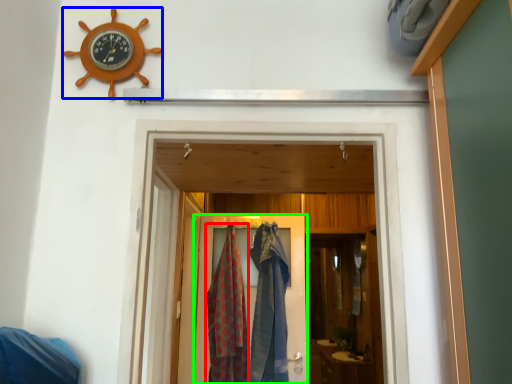
Question: Based on their relative distances, which object is farther from clothing (highlighted by a red box)? Choose from wall clock (highlighted by a blue box) and door (highlighted by a green box).

Choices:
 (A) wall clock
 (B) door

Answer: (A)